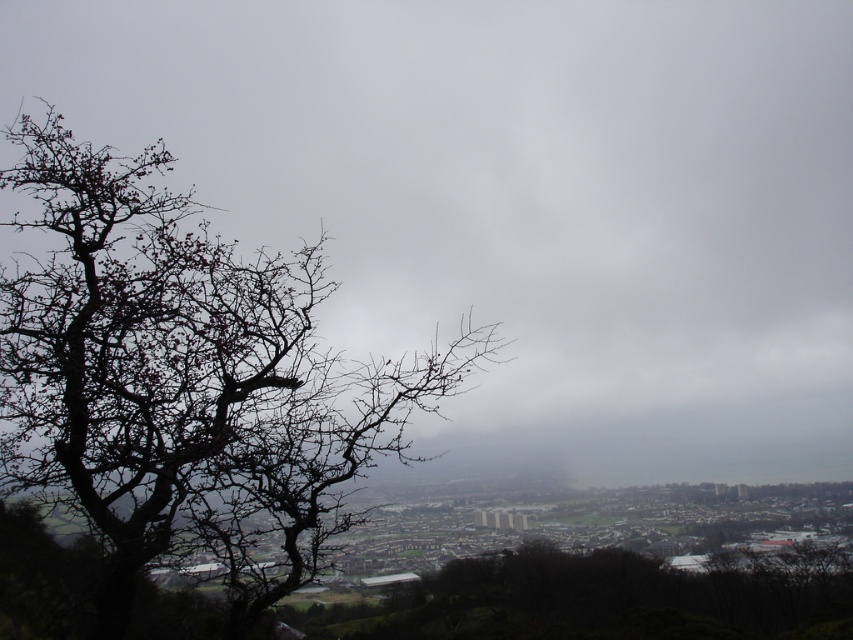
You are a bird flying over the landscape described. You need to decide whether to land on the bare branches at left or stay under the gray cloudy sky at upper center for shelter from the rain. Which option provides more coverage?

The gray cloudy sky at upper center is bigger than the bare branches at left, so it provides more coverage for shelter from the rain.

You are an artist sketching this scene. You want to draw the gray cloudy sky at upper center and the bare branches at left. Which object should you sketch first to maintain proper spatial depth?

You should sketch the gray cloudy sky at upper center first because it is closer to the viewer, so it should be drawn before the bare branches at left which are further away.